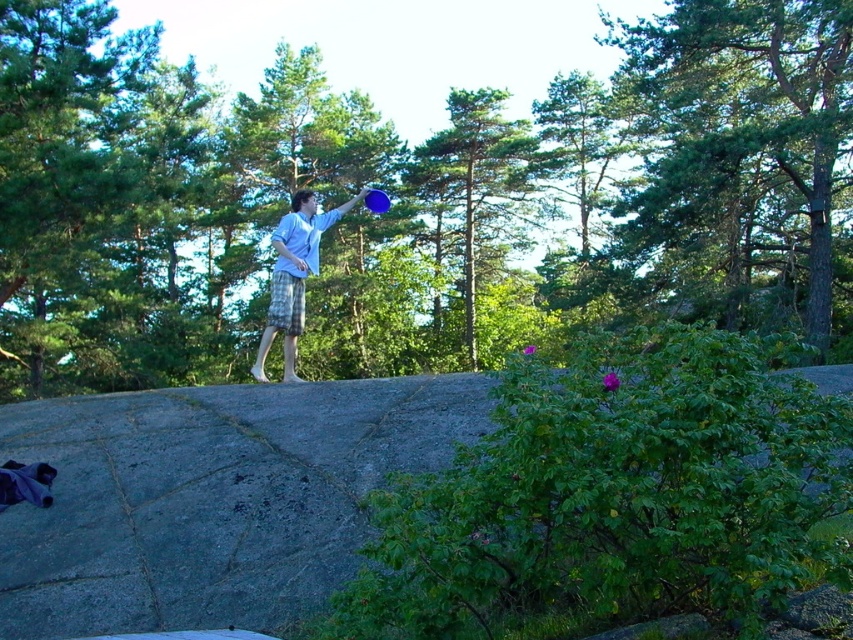
You are a hiker who wants to take a photo of the green leafy bush at center and the green leafy tree at upper right together in the same frame. Based on their distance, can you estimate if they can both fit in your camera viewfinder without moving your position?

The green leafy bush at center is 27.77 feet away from the green leafy tree at upper right. Since the distance between them is fixed, you can adjust your camera angle or zoom to include both in the frame without moving your position.

You are a hiker trying to determine the best spot to throw your blue frisbee in the forest. The green leafy bush at center and the green leafy tree at center are both in your way. Which object is taller and might block your throw more effectively?

The green leafy bush at center is taller than the green leafy tree at center, so it might block your throw more effectively.